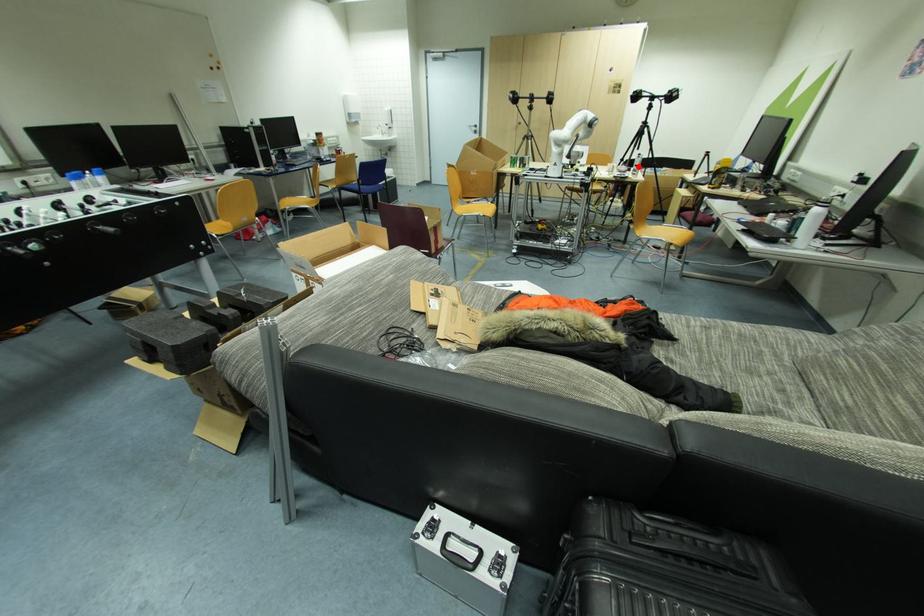
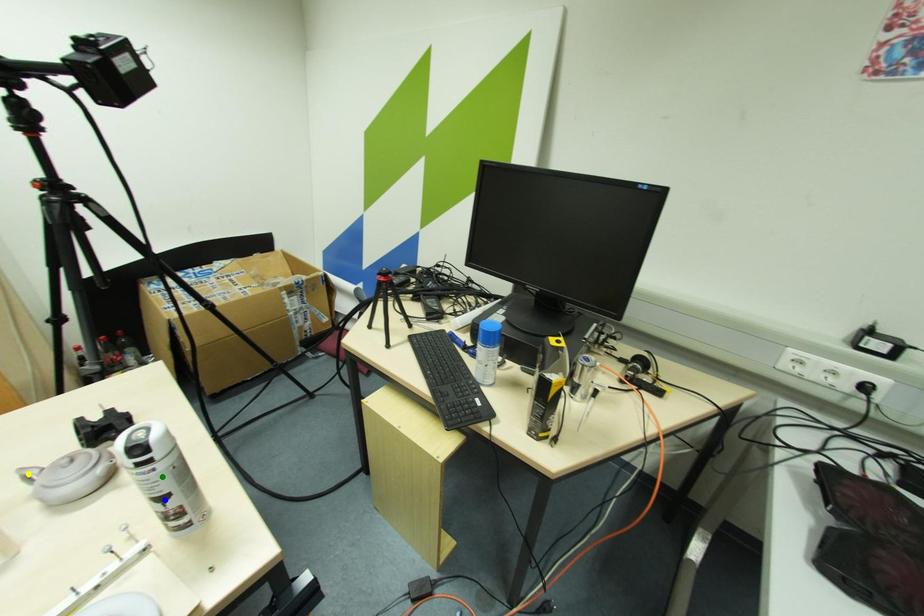
Question: I am providing you with two images of the same scene from different viewpoints. A red point is marked on the first image. You are given multiple points on the second image. In image 2, which mark is for the same physical point as the one in image 1?

Choices:
 (A) yellow point
 (B) blue point
 (C) green point

Answer: (B)